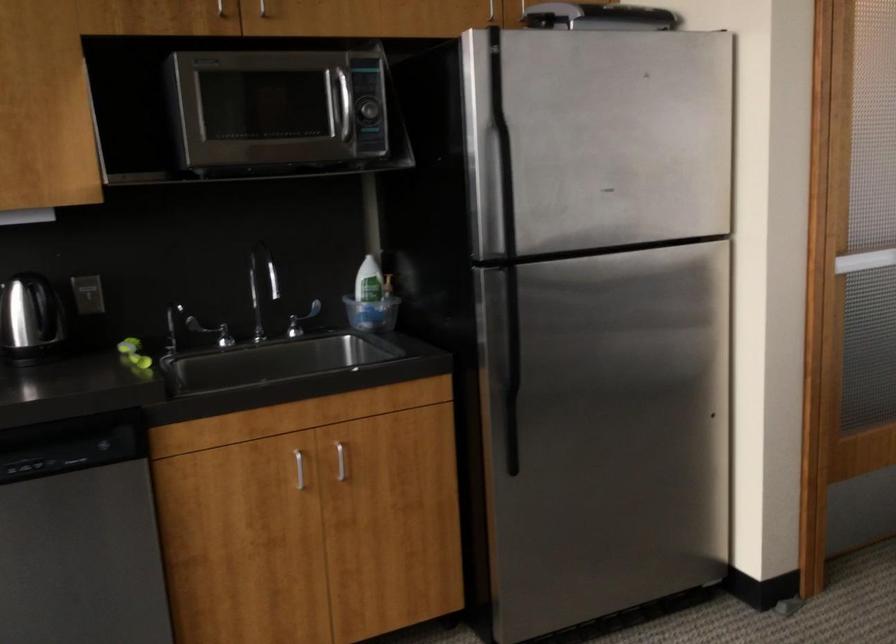
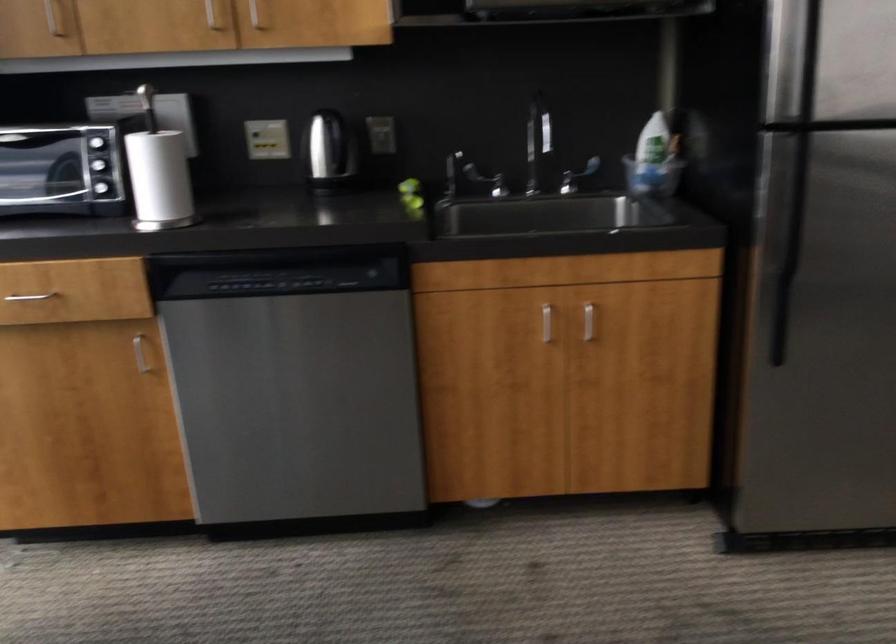
Find the pixel in the second image that matches (x=513, y=310) in the first image.

(797, 181)